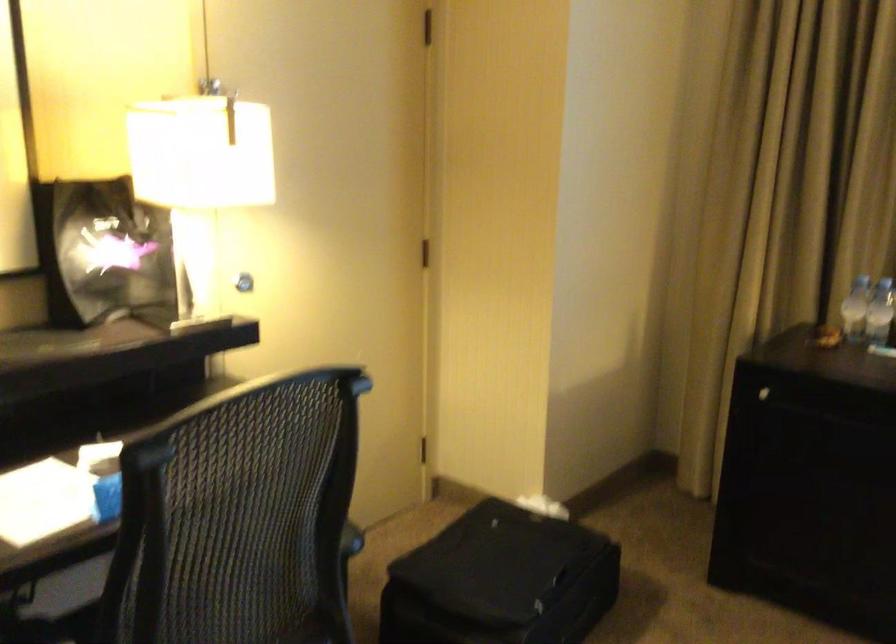
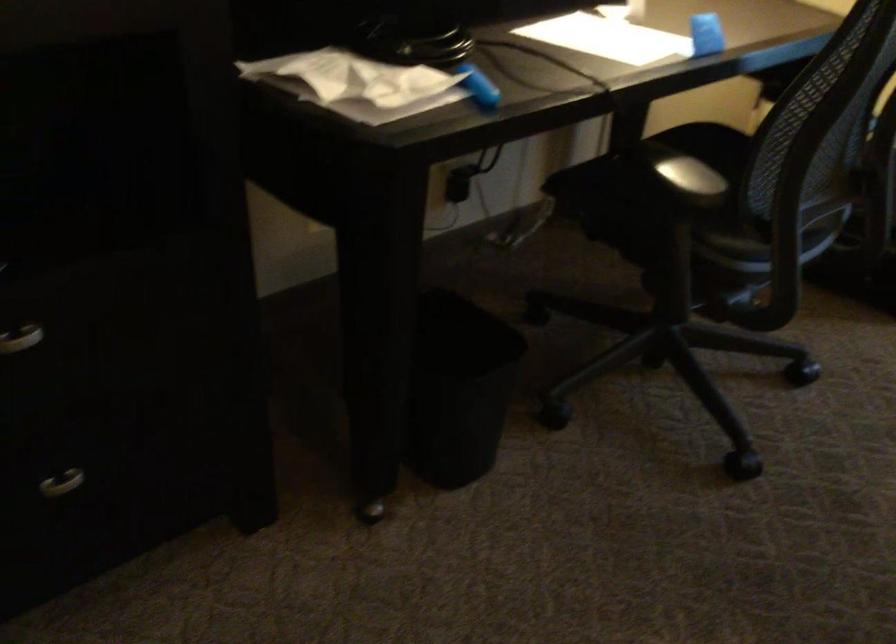
Question: What movement of the cameraman would produce the second image?

Choices:
 (A) Left
 (B) Right
 (C) Forward
 (D) Backward

Answer: (A)